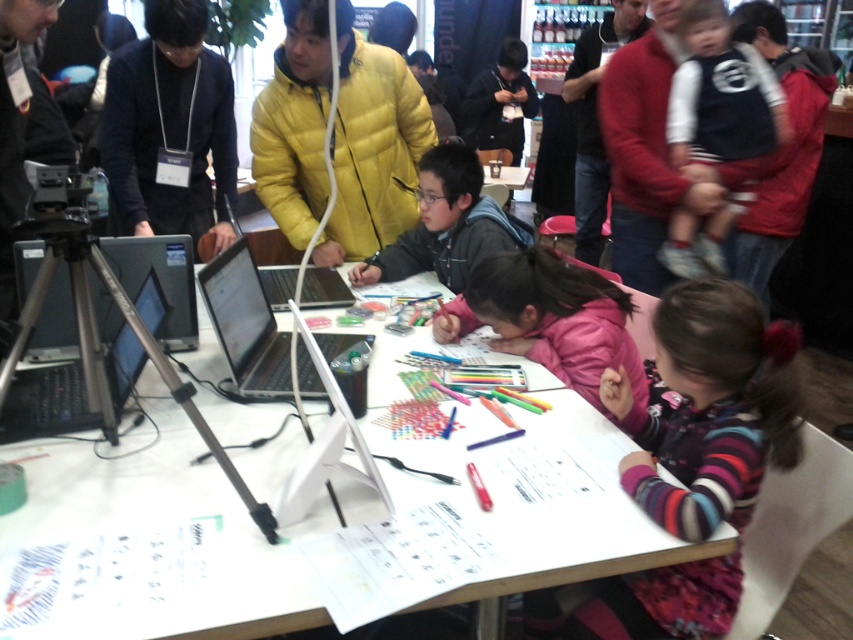
You are standing at the entrance of the workshop and see two points marked on the floor. The first point is at coordinate point (756, 388) and the second is at coordinate point (251, 129). Which point is closer to you?

Point (756, 388) is in front of point (251, 129), so the point closer to you is point (251, 129).

From the picture: You are a teacher in the workshop and need to place a 12 inch ruler between the white paper at center and the pink fleece jacket at center. Can the ruler fit in the space between them?

The distance between the white paper at center and the pink fleece jacket at center is 12.57 inches, so a 12 inch ruler can fit in the space between them since it is slightly shorter than the available distance.